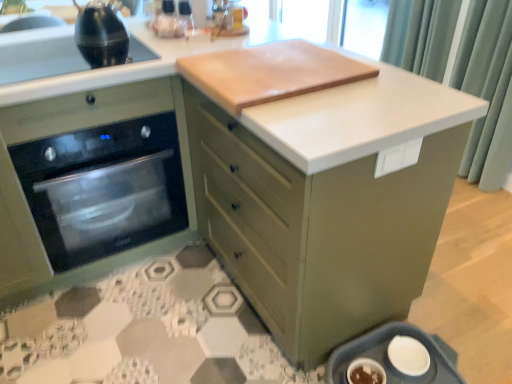
Find the location of a particular element. blank area beneath black glass sink at upper left (from a real-world perspective) is located at coordinates (61, 64).